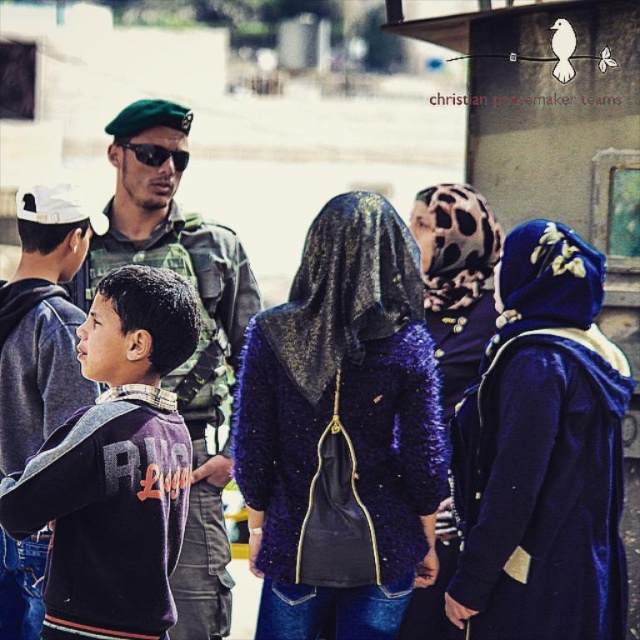
Question: Among these points, which one is nearest to the camera?

Choices:
 (A) (497, 468)
 (B) (374, 348)

Answer: (A)

Question: Can you confirm if velvet blue coat at lower right is wider than purple sequined jacket at center?

Choices:
 (A) yes
 (B) no

Answer: (A)

Question: Does velvet blue coat at lower right appear under purple sequined jacket at center?

Choices:
 (A) yes
 (B) no

Answer: (A)

Question: Can you confirm if velvet blue coat at lower right is wider than green military uniform at center?

Choices:
 (A) no
 (B) yes

Answer: (A)

Question: Which object appears farthest from the camera in this image?

Choices:
 (A) green military uniform at center
 (B) shiny blue jacket at center
 (C) purple fleece jacket at lower left

Answer: (A)

Question: Which of the following is the closest to the observer?

Choices:
 (A) (147, 404)
 (B) (518, 621)
 (C) (426, 189)

Answer: (B)